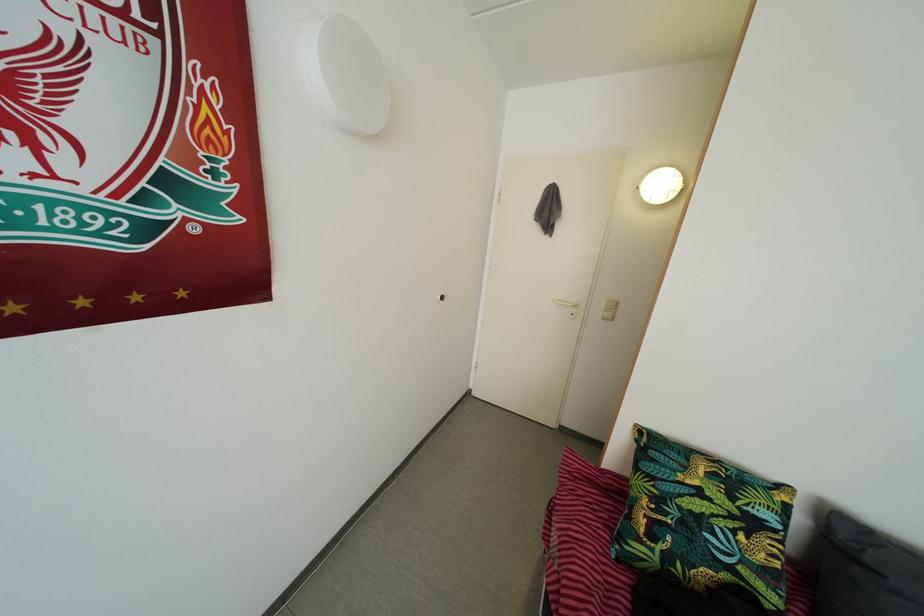
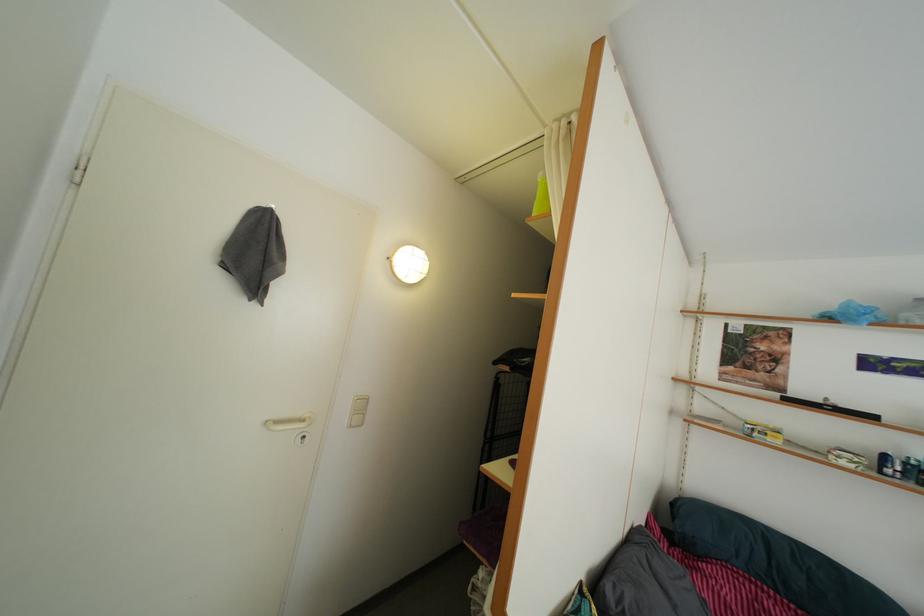
Question: The camera is either moving clockwise (left) or counter-clockwise (right) around the object. The first image is from the beginning of the video and the second image is from the end. Is the camera moving left or right when shooting the video?

Choices:
 (A) Left
 (B) Right

Answer: (A)